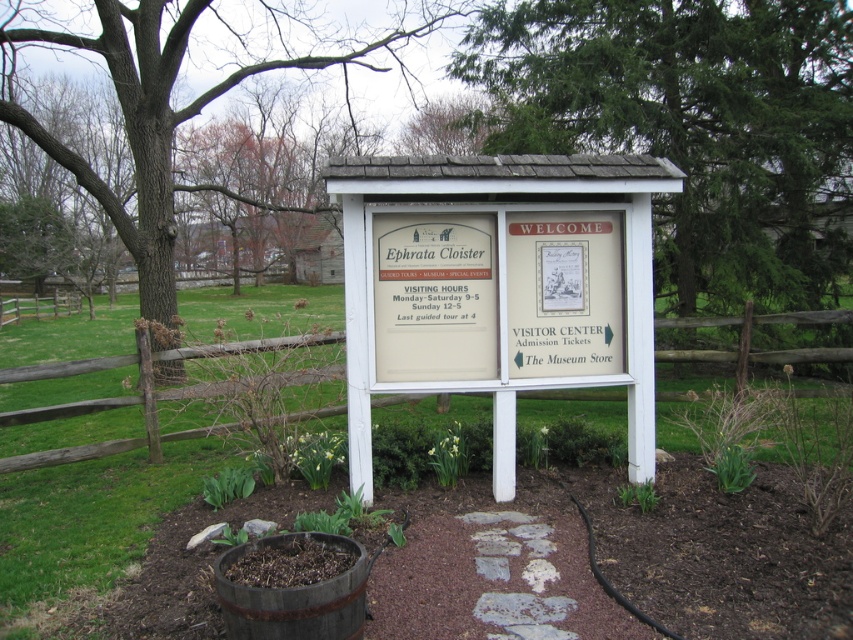
Does brown rough bark tree at upper left appear on the left side of rustic wooden barrel at lower center?

Yes, brown rough bark tree at upper left is to the left of rustic wooden barrel at lower center.

Find the location of a particular element. This screenshot has width=853, height=640. brown rough bark tree at upper left is located at coordinates (172, 106).

Identify the location of brown rough bark tree at upper left. The width and height of the screenshot is (853, 640). click(172, 106).

What do you see at coordinates (692, 125) in the screenshot? I see `green leafy tree at center` at bounding box center [692, 125].

Can you confirm if green leafy tree at center is shorter than brown rough bark tree at upper left?

Correct, green leafy tree at center is not as tall as brown rough bark tree at upper left.

I want to click on green leafy tree at center, so click(692, 125).

This screenshot has width=853, height=640. In order to click on brown rough bark tree at upper left in this screenshot , I will do `click(172, 106)`.

Between brown rough bark tree at upper left and brown wooden fence at center, which one is positioned higher?

brown rough bark tree at upper left is above.

The width and height of the screenshot is (853, 640). Find the location of `brown rough bark tree at upper left`. brown rough bark tree at upper left is located at coordinates (172, 106).

Locate an element on the screen. The image size is (853, 640). brown rough bark tree at upper left is located at coordinates (172, 106).